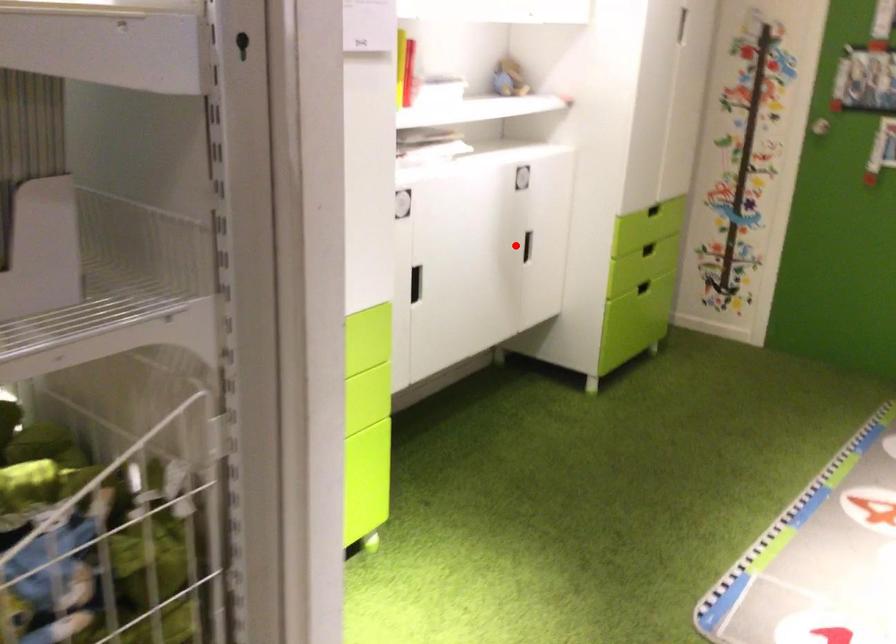
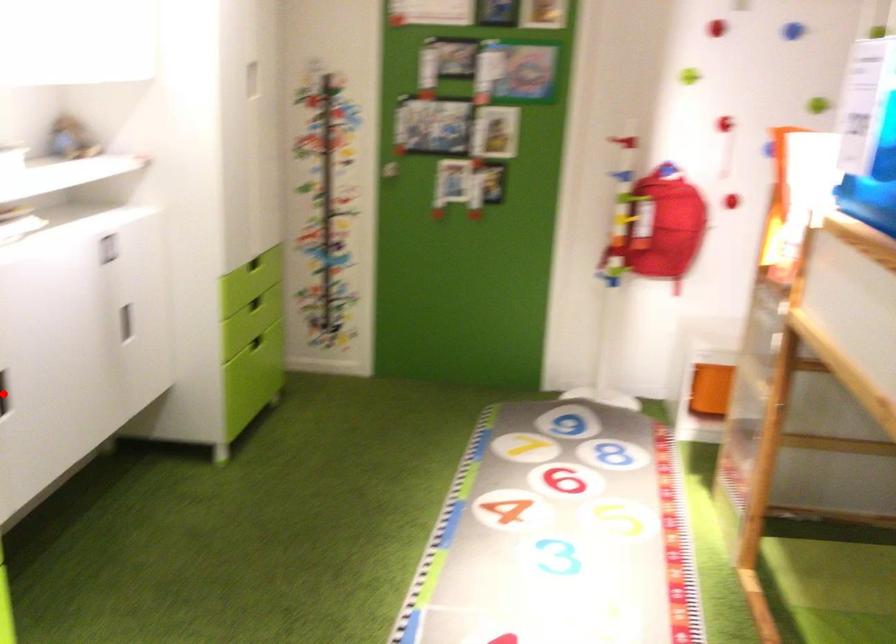
I am providing you with two images of the same scene from different viewpoints. A red point is marked on the first image and another point is marked on the second image. Does the point marked in image1 correspond to the same location as the one in image2?

No